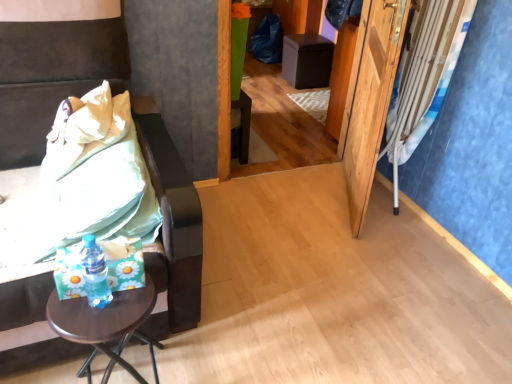
In order to click on free space that is in between wooden screen door at right and blue fabric curtain at right in this screenshot , I will do `click(382, 219)`.